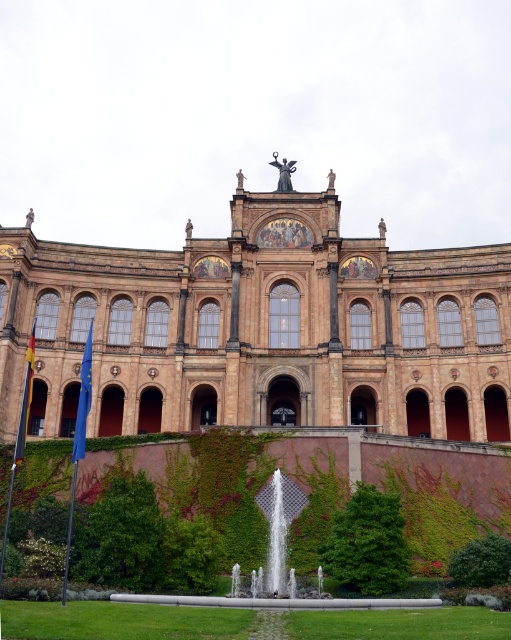
Question: Among these points, which one is nearest to the camera?

Choices:
 (A) (497, 554)
 (B) (351, 541)

Answer: (A)

Question: Is green leafy hedge at center bigger than green leafy hedge at lower right?

Choices:
 (A) no
 (B) yes

Answer: (B)

Question: Which point is closer to the camera?

Choices:
 (A) (270, 595)
 (B) (356, 557)

Answer: (B)

Question: Which object is closer to the camera taking this photo?

Choices:
 (A) clear glass water at center
 (B) green leafy hedge at lower right

Answer: (A)

Question: Can you confirm if green leafy hedge at lower left is positioned to the left of green leafy hedge at lower right?

Choices:
 (A) no
 (B) yes

Answer: (B)

Question: Considering the relative positions of brown stone palace at center and green leafy hedge at center in the image provided, where is brown stone palace at center located with respect to green leafy hedge at center?

Choices:
 (A) right
 (B) left

Answer: (B)